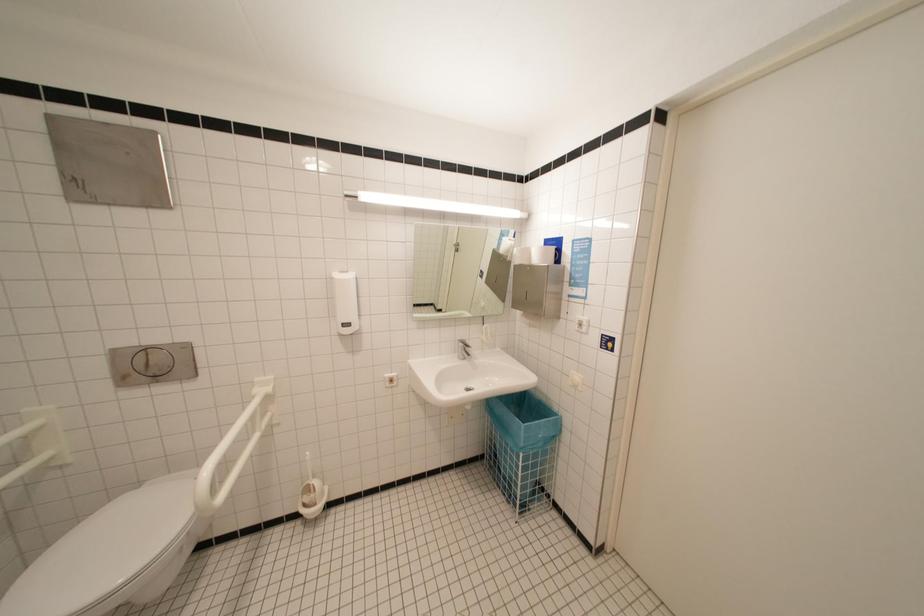
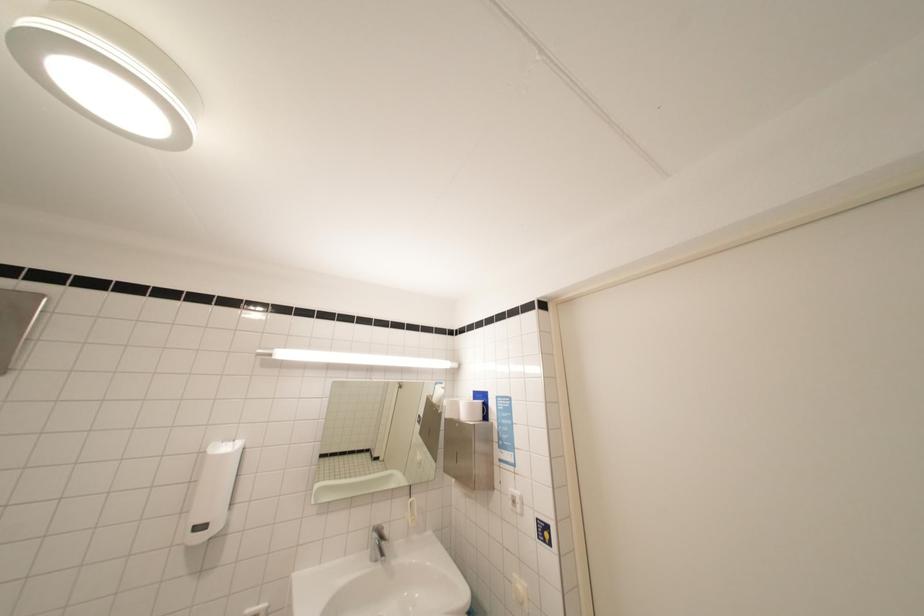
Question: The images are taken continuously from a first-person perspective. In which direction are you moving?

Choices:
 (A) Left
 (B) Right
 (C) Forward
 (D) Backward

Answer: (B)